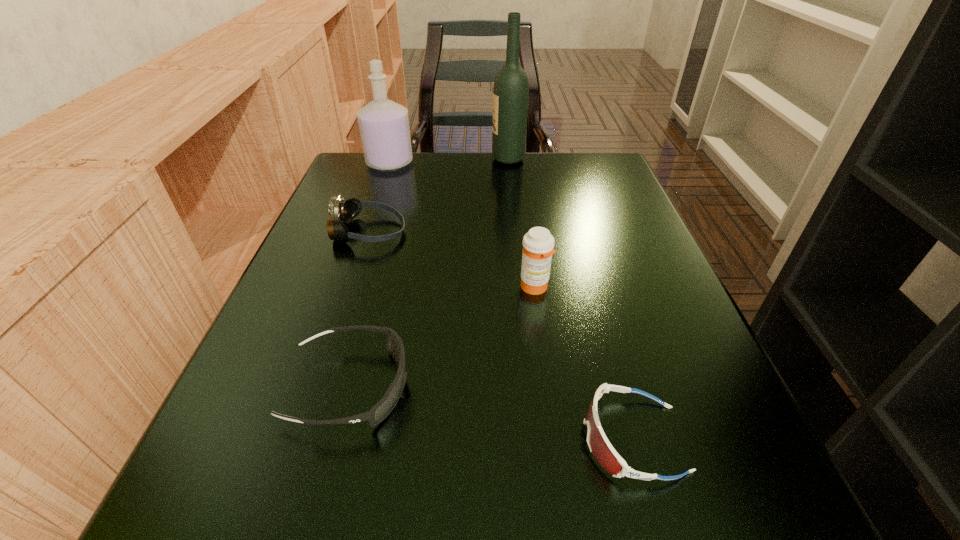
Locate an element on the screen. This screenshot has height=540, width=960. vacant area that lies between the farthest goggles and the rightmost goggles is located at coordinates (500, 335).

Identify the location of empty space that is in between the second tallest object and the rightmost object. (512, 301).

Find the location of `free space that is in between the farthest goggles and the medicine`. free space that is in between the farthest goggles and the medicine is located at coordinates (451, 259).

You are a GUI agent. You are given a task and a screenshot of the screen. Output one action in this format:
    pyautogui.click(x=<x>, y=<y>)
    Task: Click on the vacant area that lies between the second tallest object and the fourth shortest object
    This screenshot has height=540, width=960.
    Given the screenshot: What is the action you would take?
    pyautogui.click(x=462, y=225)

You are a GUI agent. You are given a task and a screenshot of the screen. Output one action in this format:
    pyautogui.click(x=<x>, y=<y>)
    Task: Click on the vacant space that is in between the wine bottle and the rightmost object
    The image size is (960, 540).
    Given the screenshot: What is the action you would take?
    (570, 299)

Locate an element on the screen. The height and width of the screenshot is (540, 960). vacant area that lies between the tallest object and the medicine is located at coordinates (521, 223).

Select which object is the closest to the medicine. Please provide its 2D coordinates. Your answer should be formatted as a tuple, i.e. [(x, y)], where the tuple contains the x and y coordinates of a point satisfying the conditions above.

[(599, 445)]

Locate an element on the screen. This screenshot has height=540, width=960. object that is the third closest to the tallest object is located at coordinates (538, 244).

Locate an element on the screen. goggles that stands as the third closest to the medicine is located at coordinates (345, 211).

Locate which goggles is the closest to the fourth farthest object. Please provide its 2D coordinates. Your answer should be formatted as a tuple, i.e. [(x, y)], where the tuple contains the x and y coordinates of a point satisfying the conditions above.

[(599, 445)]